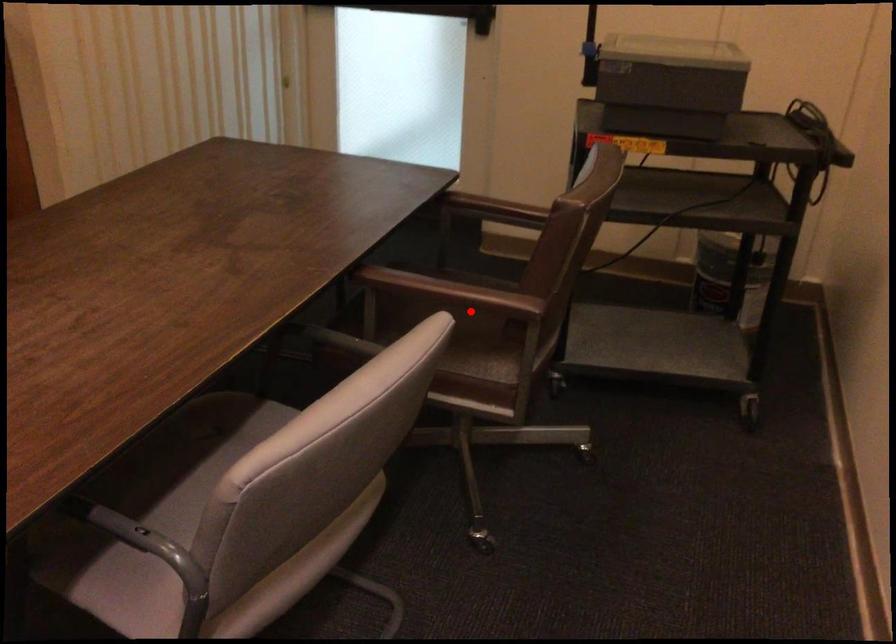
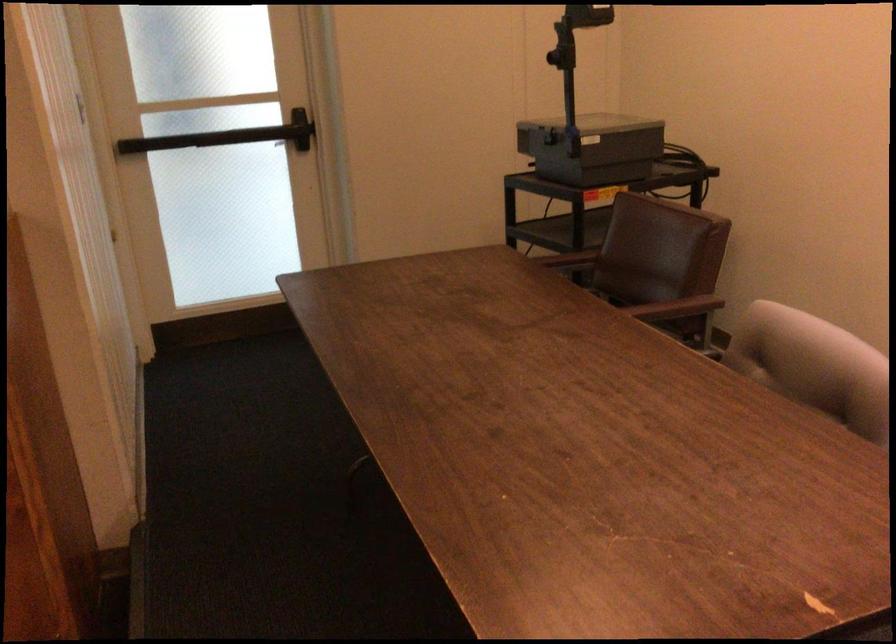
In the second image, find the point that corresponds to the highlighted location in the first image.

(677, 308)